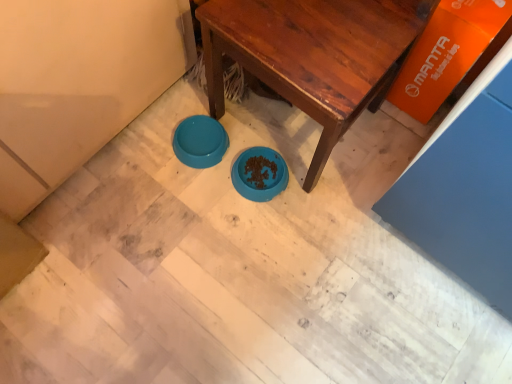
Describe the element at coordinates (312, 55) in the screenshot. I see `wooden table at center` at that location.

Locate an element on the screen. The image size is (512, 384). wooden table at center is located at coordinates (312, 55).

Find the location of `teal plastic bowl at center`. teal plastic bowl at center is located at coordinates (200, 141).

Measure the distance between teal plastic bowl at center and camera.

The distance of teal plastic bowl at center from camera is 1.33 meters.

What do you see at coordinates (200, 141) in the screenshot?
I see `teal plastic bowl at center` at bounding box center [200, 141].

Identify the location of wooden table at center. (312, 55).

Based on the photo, in the image, is teal plastic bowl at center on the left side or the right side of wooden table at center?

teal plastic bowl at center is positioned on wooden table at center's left side.

Is teal plastic bowl at center positioned before wooden table at center?

No, teal plastic bowl at center is behind wooden table at center.

Which is less distant, (188, 160) or (224, 31)?

Point (188, 160) is farther from the camera than point (224, 31).

From the image's perspective, who appears lower, teal plastic bowl at center or wooden table at center?

teal plastic bowl at center is shown below in the image.

From a real-world perspective, which is physically below, teal plastic bowl at center or wooden table at center?

In real-world perspective, teal plastic bowl at center is lower.

Considering the sizes of objects teal plastic bowl at center and wooden table at center in the image provided, who is thinner, teal plastic bowl at center or wooden table at center?

With smaller width is teal plastic bowl at center.

Which of these two, teal plastic bowl at center or wooden table at center, stands shorter?

teal plastic bowl at center.

Between teal plastic bowl at center and wooden table at center, which one has smaller size?

teal plastic bowl at center.

Is teal plastic bowl at center completely or partially outside of wooden table at center?

Indeed, teal plastic bowl at center is completely outside wooden table at center.

Is teal plastic bowl at center not close to wooden table at center?

That's not correct — teal plastic bowl at center is a little close to wooden table at center.

Is teal plastic bowl at center facing away from wooden table at center?

Yes, wooden table at center is at the back of teal plastic bowl at center.

Measure the distance between teal plastic bowl at center and wooden table at center.

They are 15.01 inches apart.

Image resolution: width=512 pixels, height=384 pixels. In order to click on table that appears above the teal plastic bowl at center (from the image's perspective) in this screenshot , I will do `click(312, 55)`.

Considering the relative positions of wooden table at center and teal plastic bowl at center in the image provided, is wooden table at center to the left of teal plastic bowl at center from the viewer's perspective?

In fact, wooden table at center is to the right of teal plastic bowl at center.

Does wooden table at center come in front of teal plastic bowl at center?

Yes, it is.

Is point (386, 8) positioned before point (204, 141)?

Yes.

From the image's perspective, is wooden table at center above or below teal plastic bowl at center?

→ Based on their image positions, wooden table at center is located above teal plastic bowl at center.

From a real-world perspective, is wooden table at center under teal plastic bowl at center?

Incorrect, from a real-world perspective, wooden table at center is higher than teal plastic bowl at center.

Can you confirm if wooden table at center is thinner than teal plastic bowl at center?

In fact, wooden table at center might be wider than teal plastic bowl at center.

Considering the sizes of objects wooden table at center and teal plastic bowl at center in the image provided, who is shorter, wooden table at center or teal plastic bowl at center?

teal plastic bowl at center is shorter.

Between wooden table at center and teal plastic bowl at center, which one has larger size?

Bigger between the two is wooden table at center.

Is teal plastic bowl at center surrounded by wooden table at center?

No, wooden table at center does not contain teal plastic bowl at center.

Is wooden table at center beside teal plastic bowl at center?

wooden table at center is not next to teal plastic bowl at center, and they're not touching.

Is wooden table at center facing away from teal plastic bowl at center?

That's not correct — wooden table at center is not looking away from teal plastic bowl at center.

The width and height of the screenshot is (512, 384). Identify the location of basin below the wooden table at center (from the image's perspective). (200, 141).

Find the location of `table above the teal plastic bowl at center (from a real-world perspective)`. table above the teal plastic bowl at center (from a real-world perspective) is located at coordinates (312, 55).

You are a GUI agent. You are given a task and a screenshot of the screen. Output one action in this format:
    pyautogui.click(x=<x>, y=<y>)
    Task: Click on the basin below the wooden table at center (from a real-world perspective)
    This screenshot has height=384, width=512.
    Given the screenshot: What is the action you would take?
    pyautogui.click(x=200, y=141)